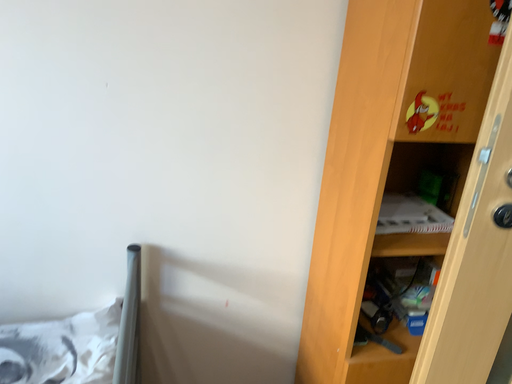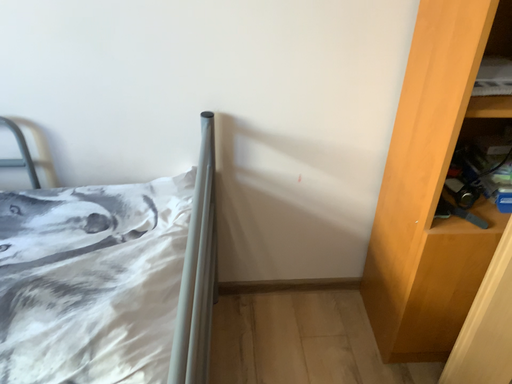
Question: Which way did the camera rotate in the video?

Choices:
 (A) rotated right
 (B) rotated left

Answer: (B)